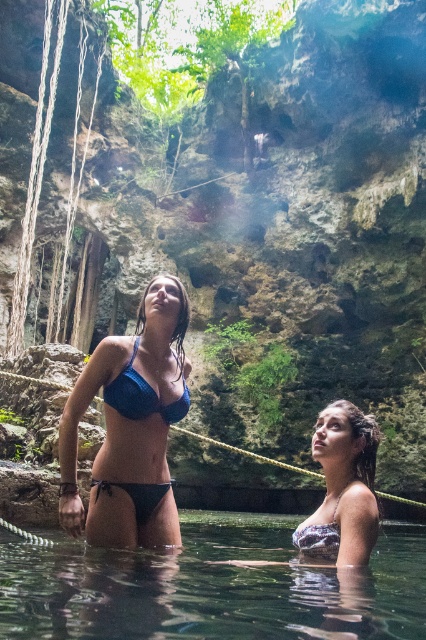
You are a swimmer planning to dive into the cenote. You see the clear water at lower center and the white lace bikini at lower center. Which object is positioned to the left of the other?

The clear water at lower center is to the left of the white lace bikini at lower center.